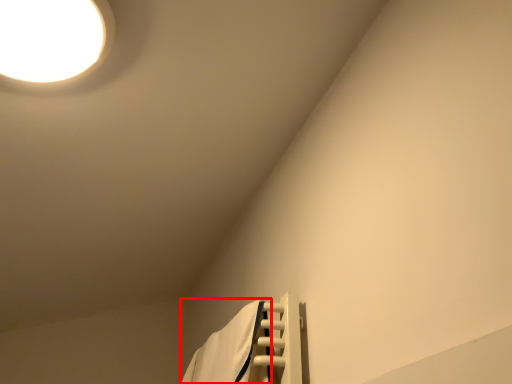
Question: From the image, what is the correct spatial relationship of bath towel (annotated by the red box) in relation to lamp?

Choices:
 (A) right
 (B) left

Answer: (A)